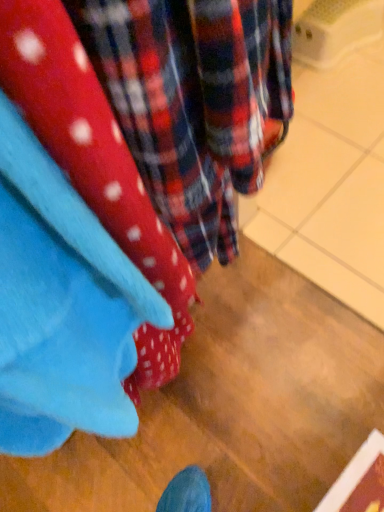
What do you see at coordinates (130, 182) in the screenshot?
I see `matte blue fabric at left` at bounding box center [130, 182].

Where is `matte blue fabric at left`? The width and height of the screenshot is (384, 512). matte blue fabric at left is located at coordinates (130, 182).

This screenshot has height=512, width=384. In order to click on matte blue fabric at left in this screenshot , I will do `click(130, 182)`.